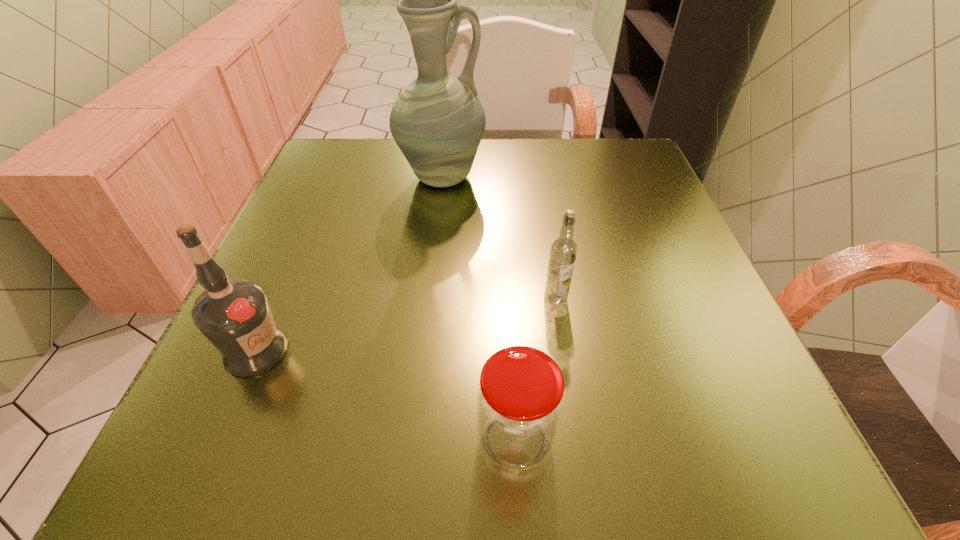
The width and height of the screenshot is (960, 540). Find the location of `vacant space at the far right corner of the desktop`. vacant space at the far right corner of the desktop is located at coordinates (602, 165).

At what (x,y) coordinates should I click in order to perform the action: click on blank space at the near right corner of the desktop. Please return your answer as a coordinate pair (x, y). The width and height of the screenshot is (960, 540). Looking at the image, I should click on pyautogui.click(x=717, y=435).

You are a GUI agent. You are given a task and a screenshot of the screen. Output one action in this format:
    pyautogui.click(x=<x>, y=<y>)
    Task: Click on the free space between the pitcher and the third shortest object
    The height and width of the screenshot is (540, 960).
    Given the screenshot: What is the action you would take?
    pyautogui.click(x=348, y=264)

At what (x,y) coordinates should I click in order to perform the action: click on blank region between the second tallest object and the shortest object. Please return your answer as a coordinate pair (x, y). Looking at the image, I should click on (386, 395).

Locate an element on the screen. This screenshot has height=540, width=960. free space between the third tallest object and the nearer vodka is located at coordinates (405, 325).

I want to click on free space between the tallest object and the taller vodka, so click(348, 264).

Identify the location of vacant space that is in between the second farthest object and the third farthest object. This screenshot has height=540, width=960. (405, 325).

Find the location of `vacant area that lies between the leftmost object and the farthest object`. vacant area that lies between the leftmost object and the farthest object is located at coordinates (348, 264).

The image size is (960, 540). Identify the location of free space between the third shortest object and the pitcher. (348, 264).

Select which object is the second closest to the shorter vodka. Please provide its 2D coordinates. Your answer should be formatted as a tuple, i.e. [(x, y)], where the tuple contains the x and y coordinates of a point satisfying the conditions above.

[(437, 121)]